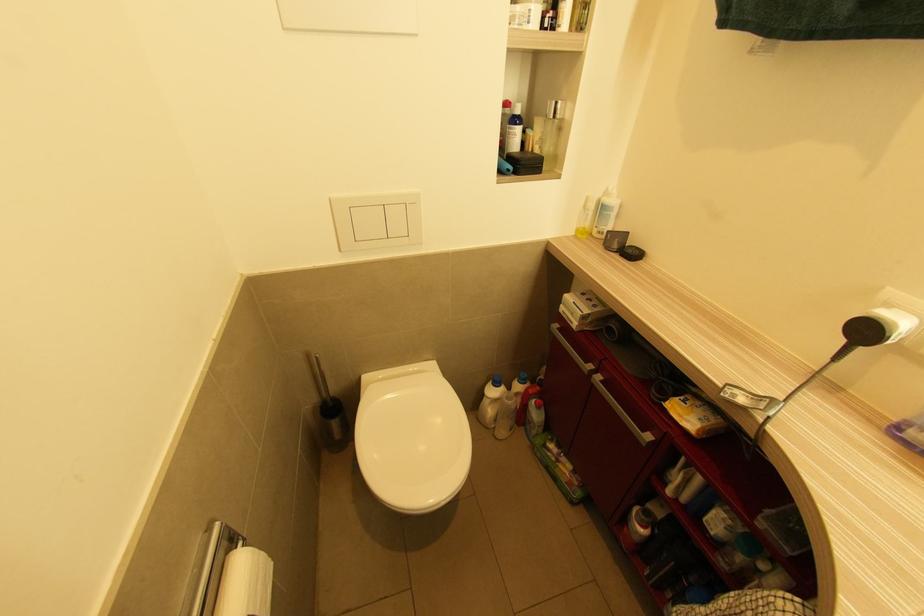
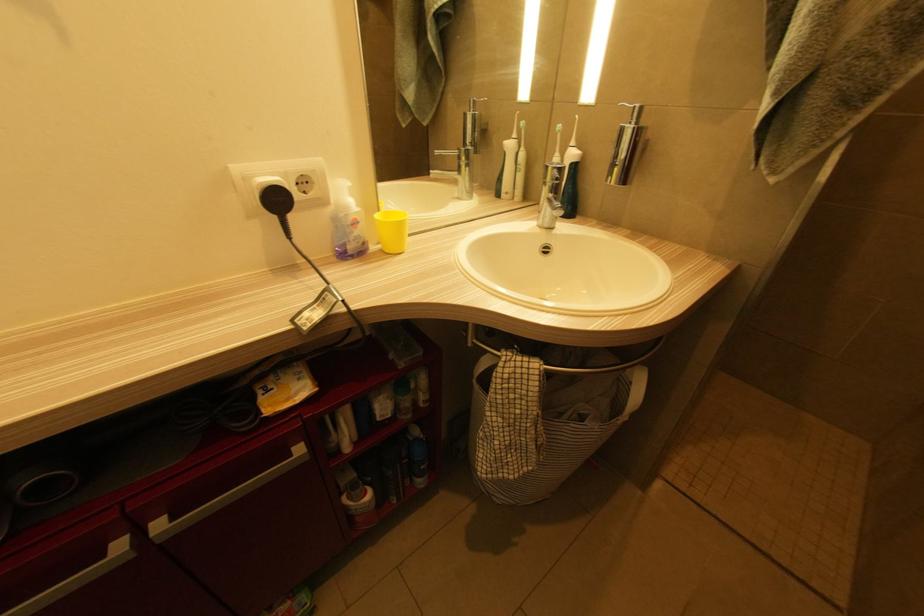
First-person continuous shooting, in which direction is the camera rotating?

The rotation direction of the camera is right-down.